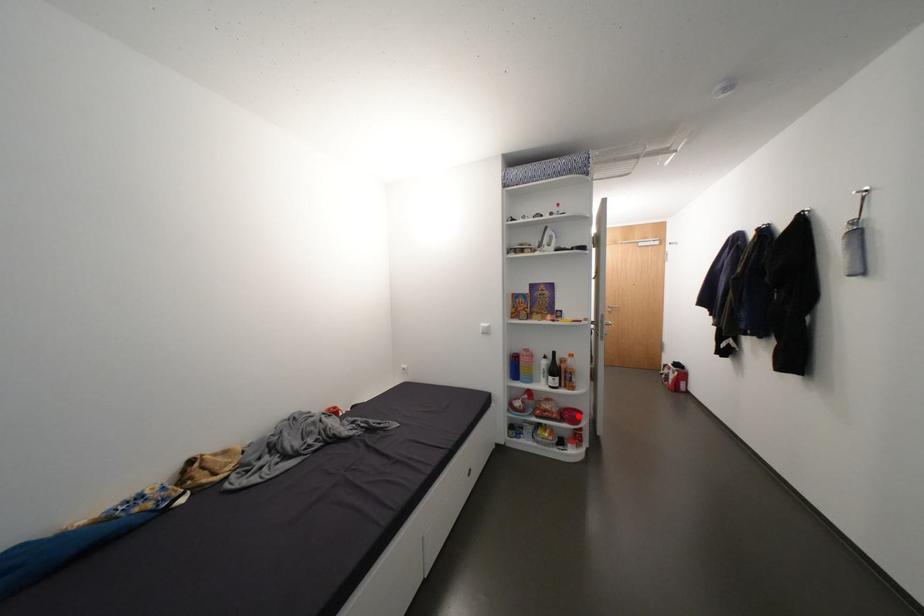
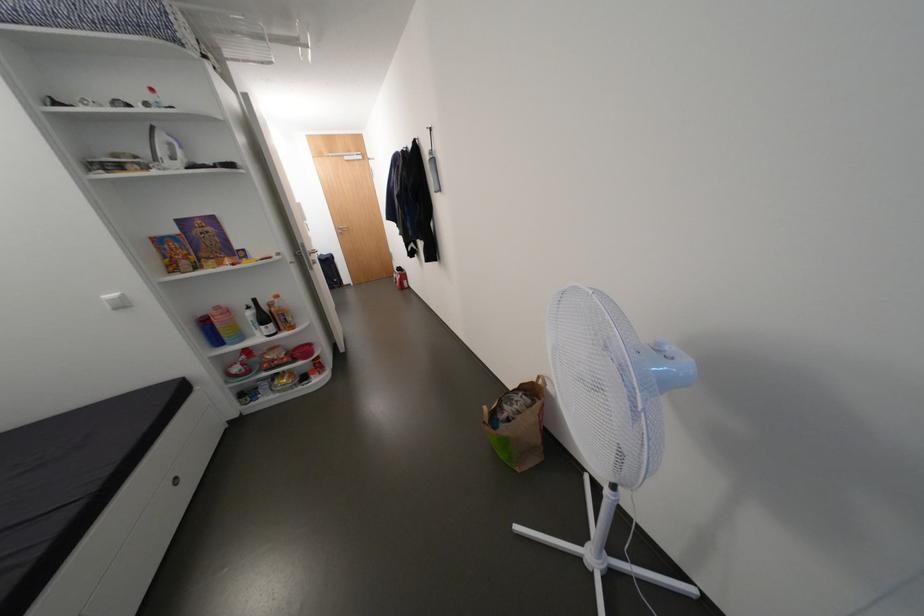
Question: I am providing you with two images of the same scene from different viewpoints. Given a red point in image1, look at the same physical point in image2. Is it:

Choices:
 (A) Closer to the viewpoint
 (B) Farther from the viewpoint

Answer: (A)